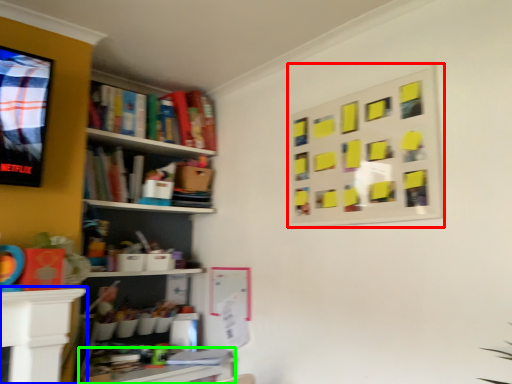
Question: Based on their relative distances, which object is farther from bulletin board (highlighted by a red box)? Choose from table (highlighted by a blue box) and table (highlighted by a green box).

Choices:
 (A) table
 (B) table

Answer: (A)